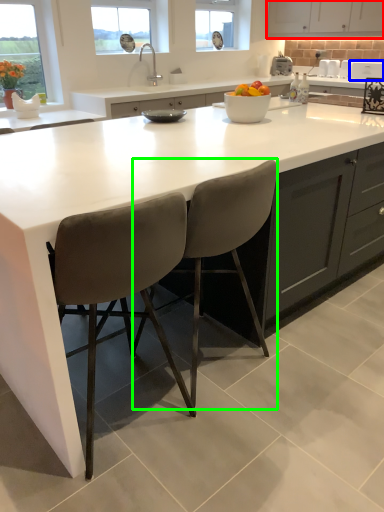
Question: Which object is positioned farthest from cabinetry (highlighted by a red box)? Select from appliance (highlighted by a blue box) and chair (highlighted by a green box).

Choices:
 (A) appliance
 (B) chair

Answer: (B)